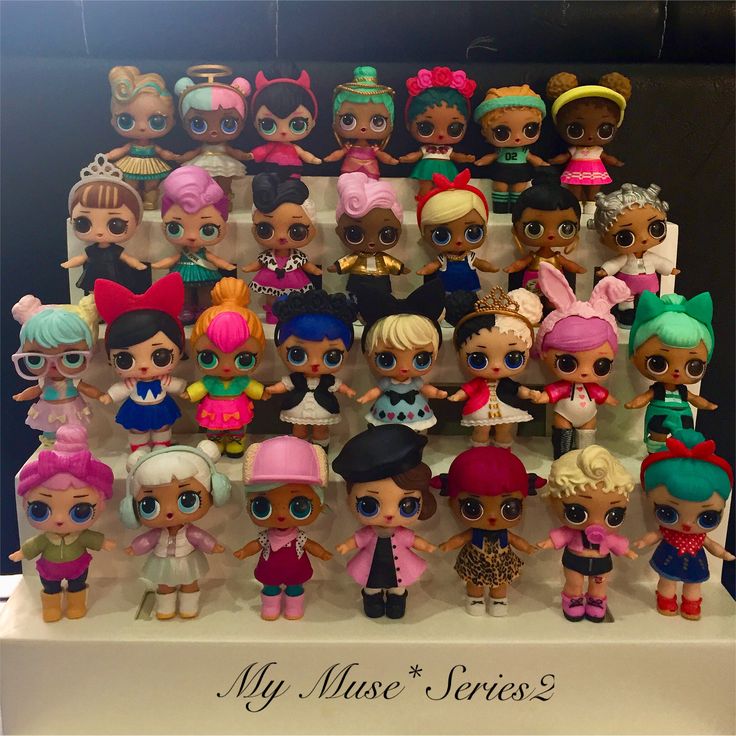
Find the location of a particular element. plastic doll with bows on their heads is located at coordinates (687, 453), (676, 311), (452, 184), (399, 314), (143, 305), (65, 467).